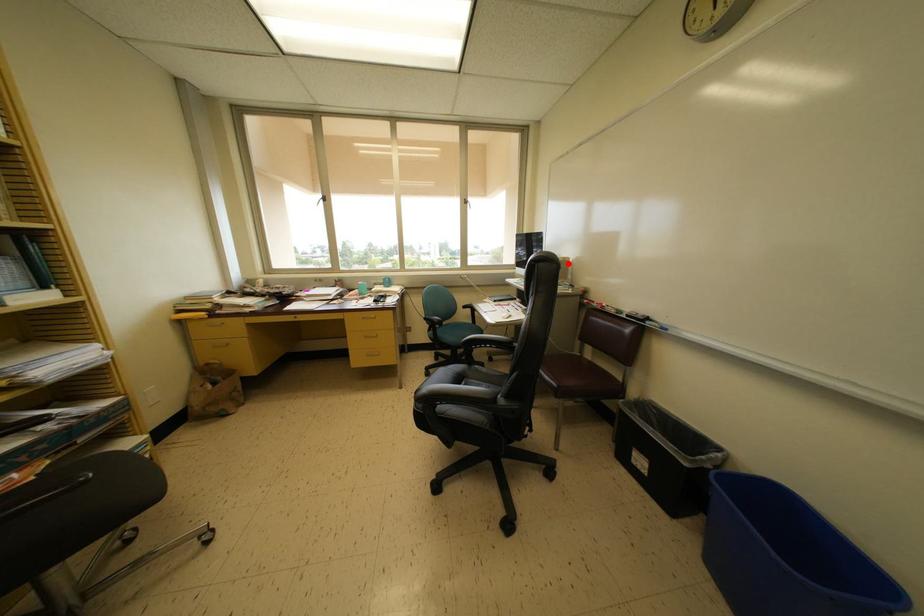
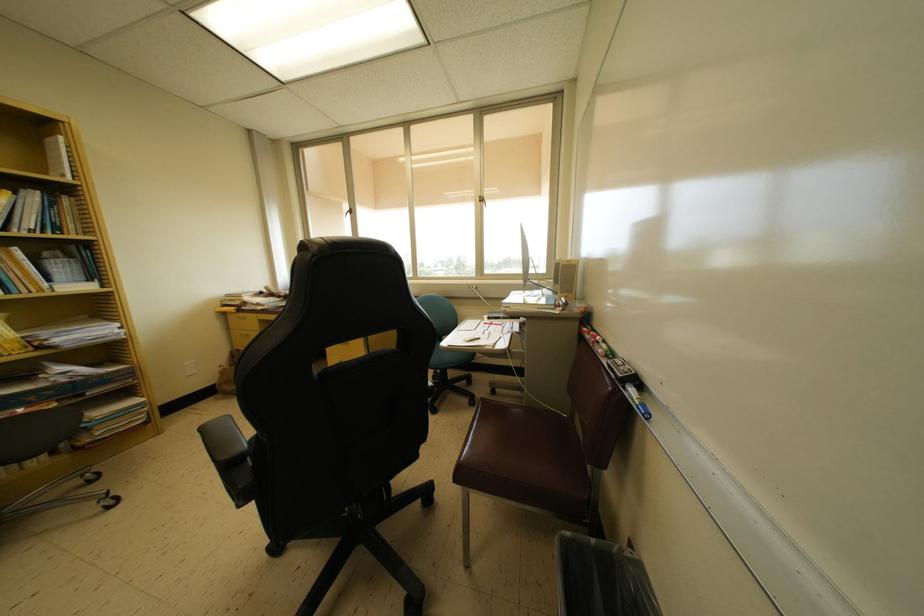
The point at the highlighted location is marked in the first image. Where is the corresponding point in the second image?

(572, 265)